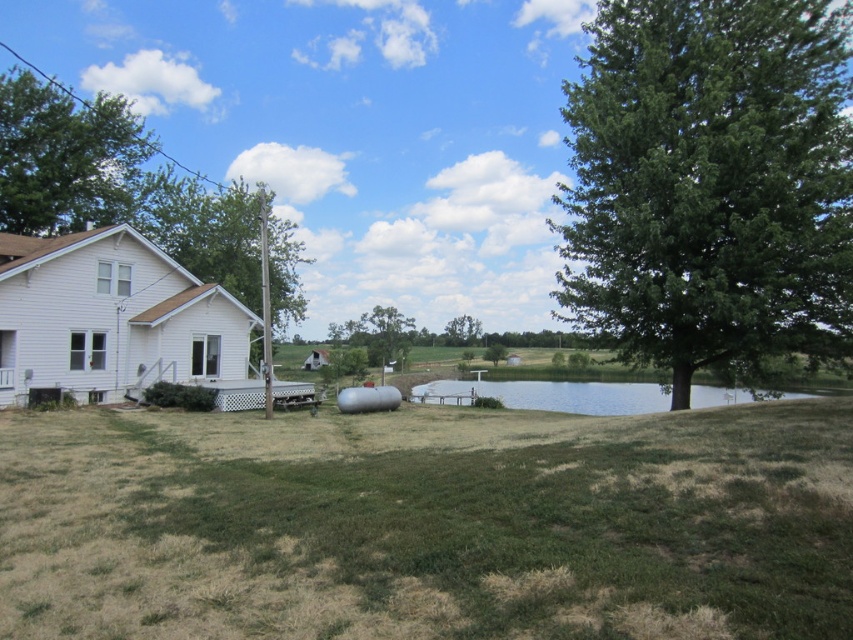
Question: Which is farther from the clear water at center?

Choices:
 (A) green leafy tree at upper left
 (B) green rough grass at lower center

Answer: (A)

Question: Is green leafy tree at right positioned before green leafy tree at center?

Choices:
 (A) no
 (B) yes

Answer: (B)

Question: Is green leafy tree at right further to the viewer compared to clear water at center?

Choices:
 (A) yes
 (B) no

Answer: (B)

Question: Which of the following is the closest to the observer?

Choices:
 (A) (218, 211)
 (B) (560, 390)
 (C) (776, 225)

Answer: (C)

Question: Can you confirm if green rough grass at lower center is smaller than green leafy tree at center?

Choices:
 (A) yes
 (B) no

Answer: (A)

Question: Which object is closer to the camera taking this photo?

Choices:
 (A) green leafy tree at right
 (B) clear water at center
 (C) green matte tree at upper left

Answer: (A)